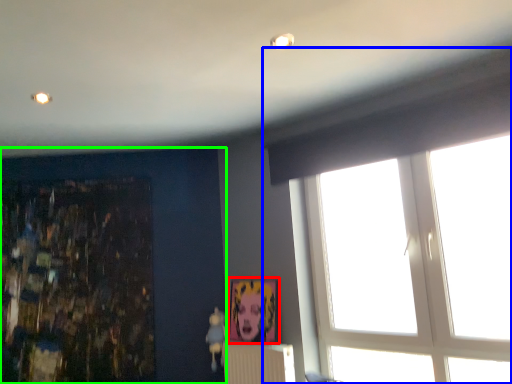
Question: Which object is the farthest from picture frame (highlighted by a red box)? Choose among these: window (highlighted by a blue box) or backdrop (highlighted by a green box).

Choices:
 (A) window
 (B) backdrop

Answer: (A)